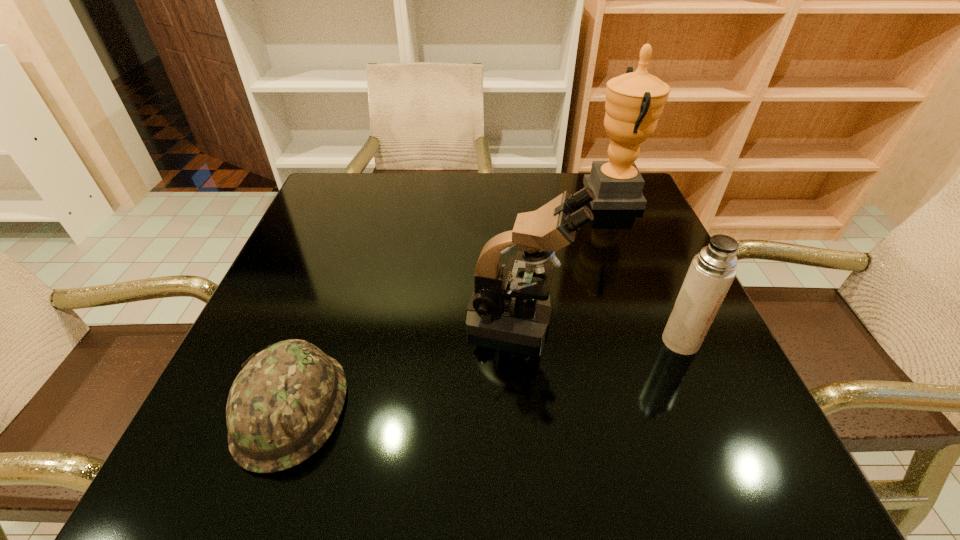
At what (x,y) coordinates should I click in order to perform the action: click on vacant space that satisfies the following two spatial constraints: 1. on the back side of the thermos bottle; 2. at the front of the farthest object with handles. Please return your answer as a coordinate pair (x, y). Looking at the image, I should click on (617, 194).

Identify the location of vacant space that satisfies the following two spatial constraints: 1. on the front side of the third tallest object; 2. on the right side of the microscope. (521, 341).